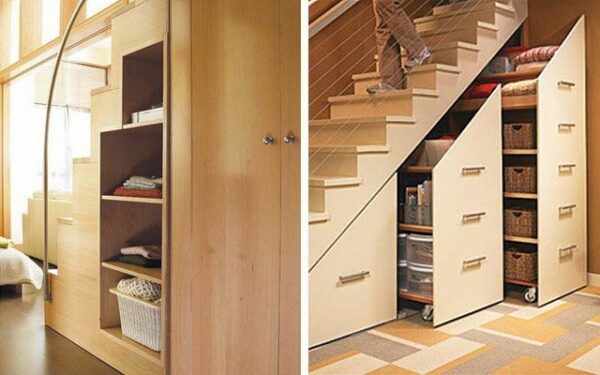
This screenshot has height=375, width=600. I want to click on under stairs pull out shelves, so click(x=462, y=199), click(x=352, y=243), click(x=551, y=149).